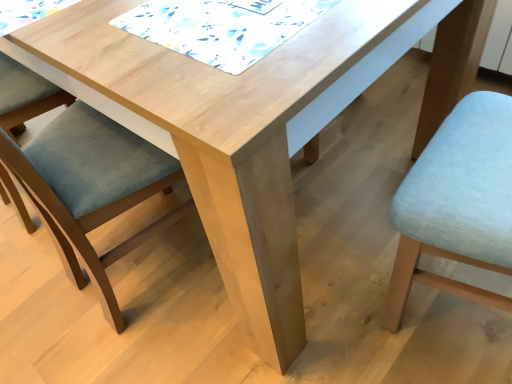
Question: Is light blue fabric chair at lower right, positioned as the first chair in right-to-left order, shorter than white printed fabric at upper center?

Choices:
 (A) yes
 (B) no

Answer: (B)

Question: Does light blue fabric chair at lower right, positioned as the first chair in right-to-left order, have a greater width compared to white printed fabric at upper center?

Choices:
 (A) no
 (B) yes

Answer: (A)

Question: Is light blue fabric chair at lower right, arranged as the second chair when viewed from the left, not inside white printed fabric at upper center?

Choices:
 (A) yes
 (B) no

Answer: (A)

Question: Is light blue fabric chair at lower right, positioned as the first chair in right-to-left order, positioned before white printed fabric at upper center?

Choices:
 (A) yes
 (B) no

Answer: (A)

Question: Is white printed fabric at upper center a part of light blue fabric chair at lower right, positioned as the first chair in right-to-left order?

Choices:
 (A) no
 (B) yes

Answer: (A)

Question: From the image's perspective, does light blue fabric chair at lower right, positioned as the first chair in right-to-left order, appear lower than white printed fabric at upper center?

Choices:
 (A) yes
 (B) no

Answer: (A)

Question: Would you say light blue fabric chair at lower right, arranged as the second chair when viewed from the left, is outside matte blue cushion at left, arranged as the first chair when viewed from the left?

Choices:
 (A) no
 (B) yes

Answer: (B)

Question: Is light blue fabric chair at lower right, arranged as the second chair when viewed from the left, beside matte blue cushion at left, arranged as the second chair when viewed from the right?

Choices:
 (A) yes
 (B) no

Answer: (B)

Question: Considering the relative sizes of light blue fabric chair at lower right, arranged as the second chair when viewed from the left, and matte blue cushion at left, arranged as the second chair when viewed from the right, in the image provided, is light blue fabric chair at lower right, arranged as the second chair when viewed from the left, wider than matte blue cushion at left, arranged as the second chair when viewed from the right,?

Choices:
 (A) yes
 (B) no

Answer: (B)

Question: Considering the relative sizes of light blue fabric chair at lower right, positioned as the first chair in right-to-left order, and matte blue cushion at left, arranged as the first chair when viewed from the left, in the image provided, is light blue fabric chair at lower right, positioned as the first chair in right-to-left order, bigger than matte blue cushion at left, arranged as the first chair when viewed from the left,?

Choices:
 (A) yes
 (B) no

Answer: (B)

Question: Is light blue fabric chair at lower right, positioned as the first chair in right-to-left order, looking in the opposite direction of matte blue cushion at left, arranged as the first chair when viewed from the left?

Choices:
 (A) no
 (B) yes

Answer: (A)

Question: From the image's perspective, is light blue fabric chair at lower right, positioned as the first chair in right-to-left order, over matte blue cushion at left, arranged as the first chair when viewed from the left?

Choices:
 (A) no
 (B) yes

Answer: (A)

Question: Can you confirm if white printed fabric at upper center is bigger than matte blue cushion at left, arranged as the second chair when viewed from the right?

Choices:
 (A) no
 (B) yes

Answer: (A)